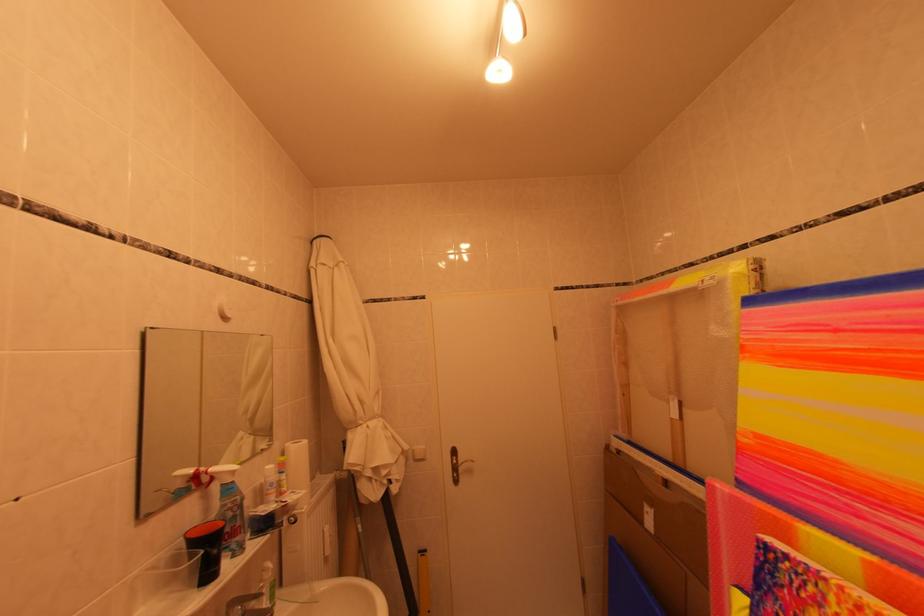
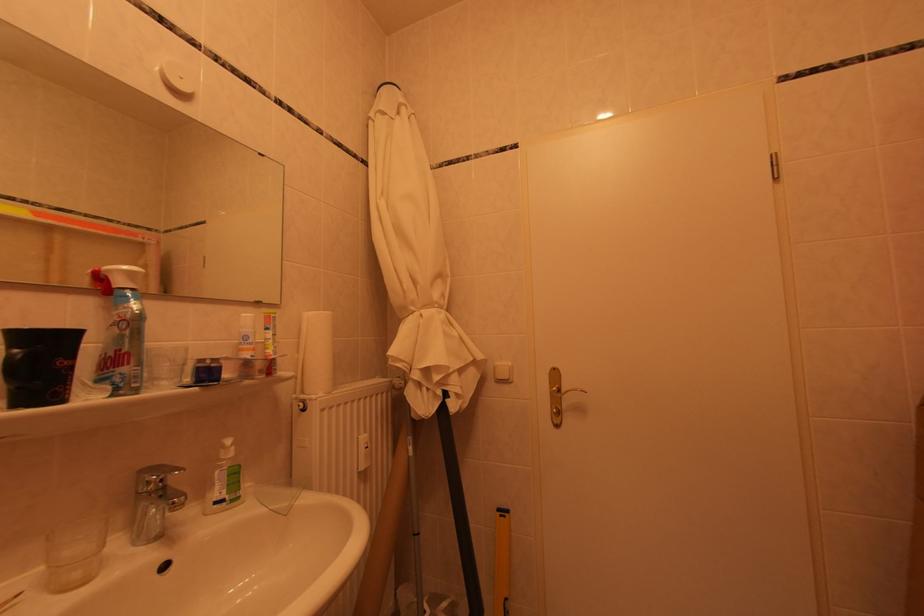
Question: The first image is from the beginning of the video and the second image is from the end. How did the camera likely rotate when shooting the video?

Choices:
 (A) Left
 (B) Right
 (C) Up
 (D) Down

Answer: (A)